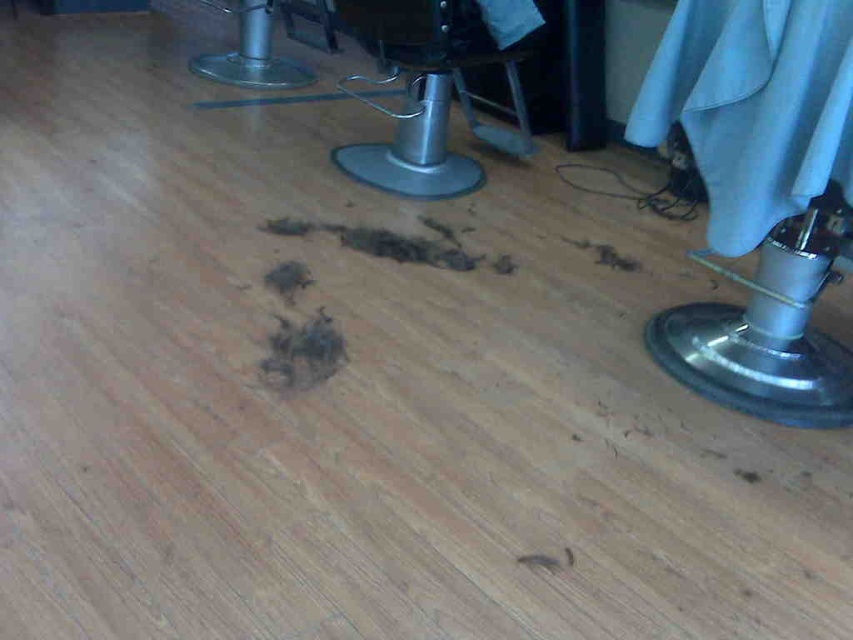
You are a customer entering the barbershop and want to sit in the metallic silver chair at center. Based on the coordinates provided in the scene description, can you determine if this chair is positioned closer to the entrance or the back wall?

The metallic silver chair at center is located at point (421, 92), which places it closer to the entrance since lower coordinate values typically indicate proximity to the entrance in such coordinate systems.

You are a customer entering the barbershop and see two points marked on the floor. The first point is at coordinate point (380, 166) and the second is at coordinate point (331, 326). If you are facing the entrance, which point is closer to the back wall?

Point (380, 166) is behind point (331, 326), so it is closer to the back wall.